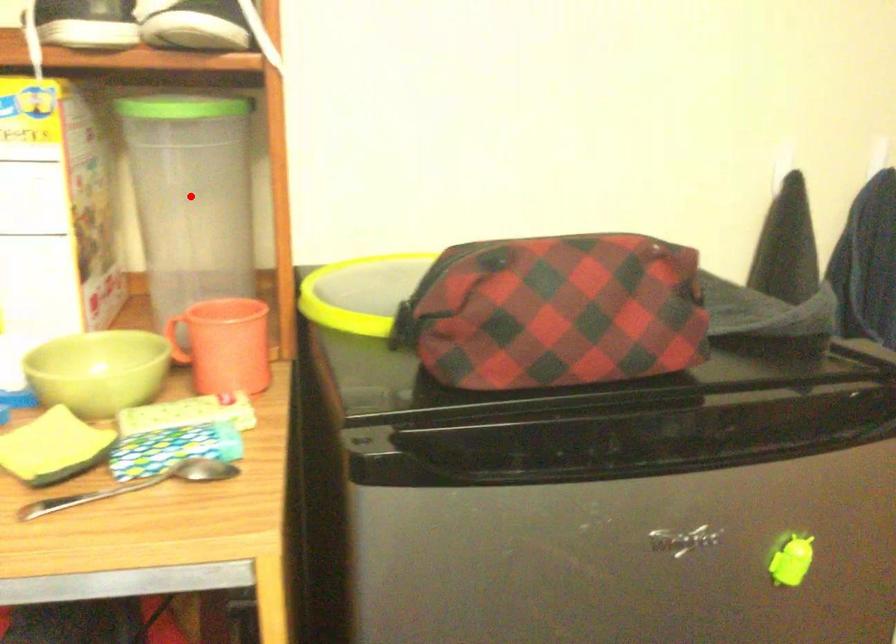
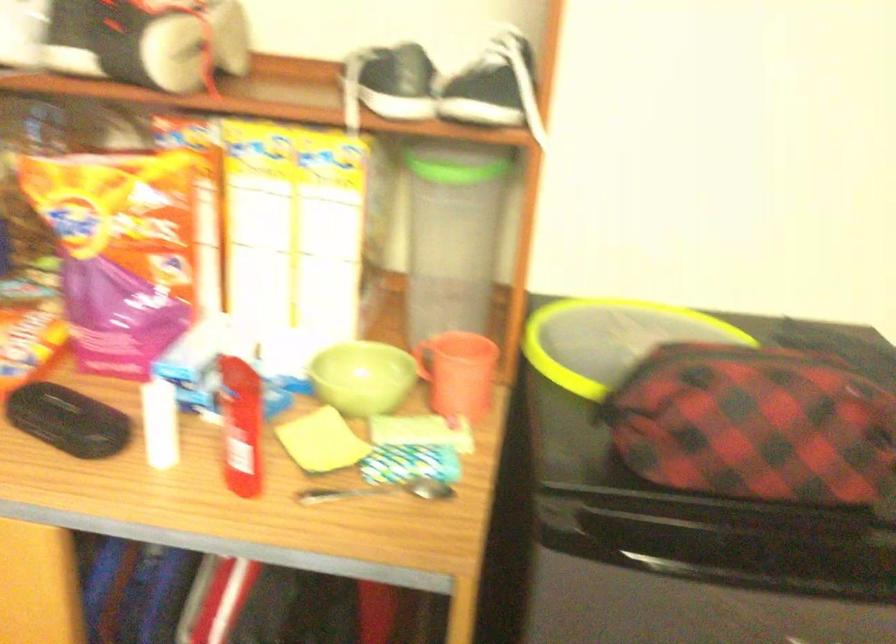
Question: I am providing you with two images of the same scene from different viewpoints. A red point is marked on the first image. Can you still see the location of the red point in image 2?

Choices:
 (A) Yes
 (B) No

Answer: (B)